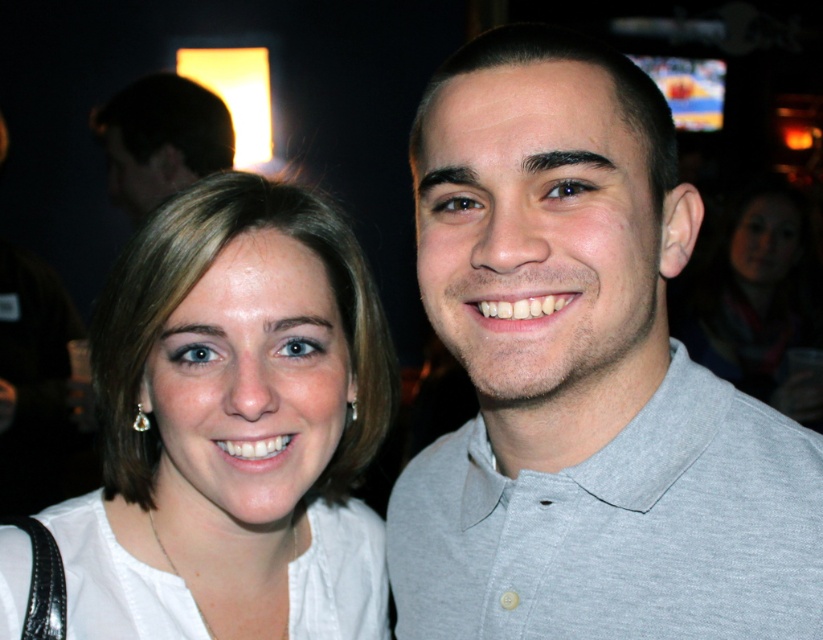
Does gray cotton polo shirt at center have a greater width compared to dark brown hair at upper left?

In fact, gray cotton polo shirt at center might be narrower than dark brown hair at upper left.

Locate an element on the screen. The height and width of the screenshot is (640, 823). gray cotton polo shirt at center is located at coordinates coord(584,378).

Locate an element on the screen. The image size is (823, 640). gray cotton polo shirt at center is located at coordinates (584, 378).

Identify the location of gray cotton polo shirt at center. The height and width of the screenshot is (640, 823). (584, 378).

Does white matte shirt at left have a lesser height compared to white cotton shirt at center?

No, white matte shirt at left is not shorter than white cotton shirt at center.

Who is more forward, (156, 490) or (75, 625)?

Point (75, 625) is in front.

You are a GUI agent. You are given a task and a screenshot of the screen. Output one action in this format:
    pyautogui.click(x=<x>, y=<y>)
    Task: Click on the white matte shirt at left
    
    Given the screenshot: What is the action you would take?
    pyautogui.click(x=233, y=428)

Image resolution: width=823 pixels, height=640 pixels. I want to click on white matte shirt at left, so click(233, 428).

Is white cotton shirt at center behind dark brown hair at upper left?

No.

Is white cotton shirt at center above dark brown hair at upper left?

Incorrect, white cotton shirt at center is not positioned above dark brown hair at upper left.

Between point (71, 529) and point (114, 196), which one is positioned in front?

Positioned in front is point (71, 529).

Locate an element on the screen. Image resolution: width=823 pixels, height=640 pixels. white cotton shirt at center is located at coordinates (115, 580).